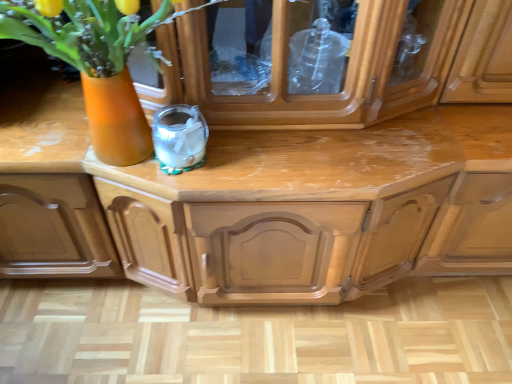
Identify the location of clear glass teapot at center. (179, 138).

The height and width of the screenshot is (384, 512). What do you see at coordinates (179, 138) in the screenshot?
I see `clear glass teapot at center` at bounding box center [179, 138].

You are a GUI agent. You are given a task and a screenshot of the screen. Output one action in this format:
    pyautogui.click(x=<x>, y=<y>)
    Task: Click on the clear glass teapot at center
    
    Given the screenshot: What is the action you would take?
    pyautogui.click(x=179, y=138)